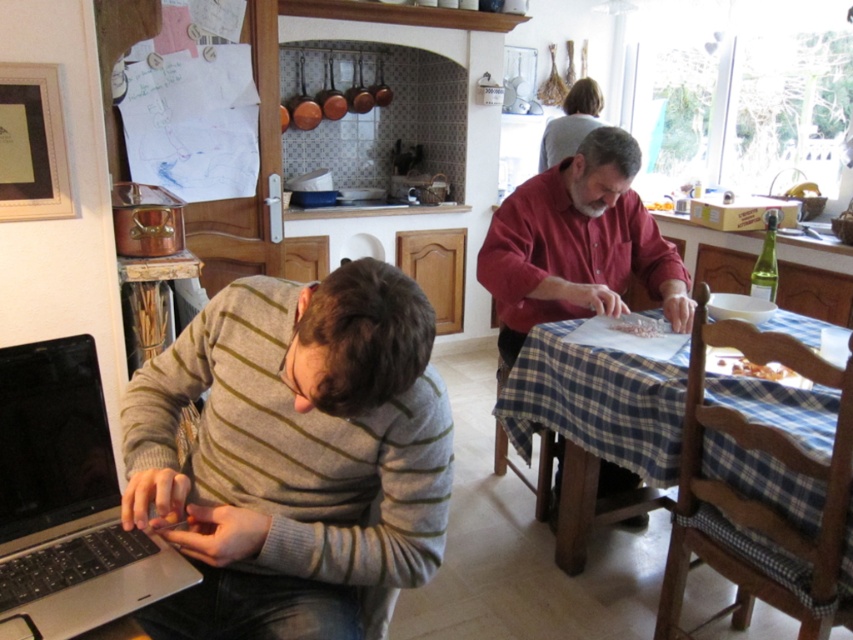
You are a chef preparing a meal and need to place the white crumbly food at table on the blue checkered tablecloth at center. Can you fit it without it hanging off the edge?

The blue checkered tablecloth at center is taller than the white crumbly food at table, so yes, the white crumbly food at table can be placed on it without hanging off the edge since the tablecloth is larger in height.

You are planning to place a large plate on the table. The blue checkered tablecloth at center and the light gray sweater at upper center are both on the table. Which object has enough space to accommodate the plate without overlapping?

The blue checkered tablecloth at center is bigger than the light gray sweater at upper center, so placing the plate on the blue checkered tablecloth at center would provide enough space without overlapping.

You are standing at the point labeled point (569, 136) and want to move to the point labeled point (758, 381). Which direction should you move in to reach your destination?

You should move forward to reach point (758, 381) from point (569, 136) since it is in front of your current position.